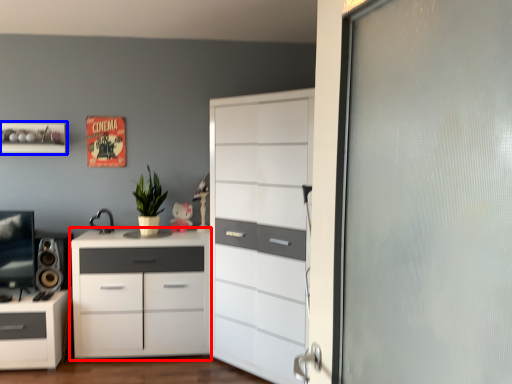
Question: Which object appears closest to the camera in this image, chest of drawers (highlighted by a red box) or shelf (highlighted by a blue box)?

Choices:
 (A) chest of drawers
 (B) shelf

Answer: (A)